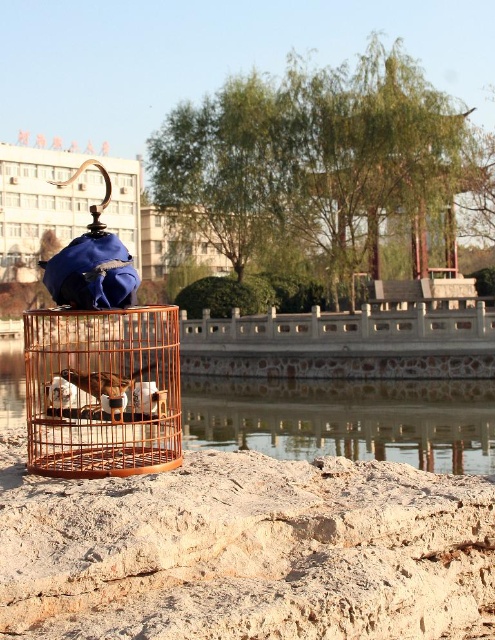
Question: Which point is closer to the camera?

Choices:
 (A) (369, 412)
 (B) (127, 388)

Answer: (B)

Question: Which of the following is the farthest from the observer?

Choices:
 (A) (121, 392)
 (B) (186, 404)

Answer: (B)

Question: Does transparent glass water at center appear on the left side of white feathered bird at center?

Choices:
 (A) no
 (B) yes

Answer: (B)

Question: Considering the relative positions of brown wooden birdcage at center and white feathered bird at center in the image provided, where is brown wooden birdcage at center located with respect to white feathered bird at center?

Choices:
 (A) left
 (B) right

Answer: (A)

Question: Estimate the real-world distances between objects in this image. Which object is farther from the transparent glass water at center?

Choices:
 (A) white feathered bird at center
 (B) brown wooden birdcage at center

Answer: (A)

Question: Can you confirm if transparent glass water at center is positioned to the right of white feathered bird at center?

Choices:
 (A) no
 (B) yes

Answer: (A)